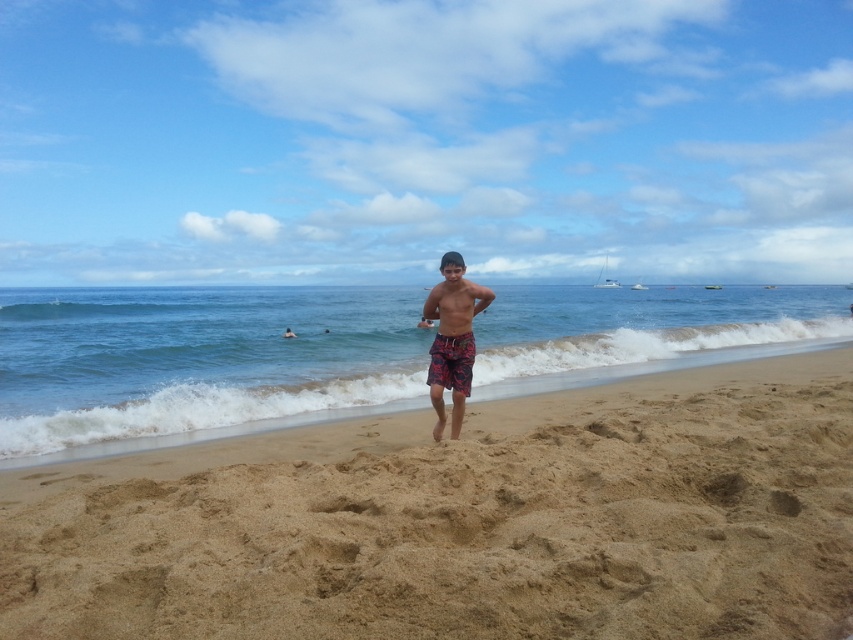
Can you confirm if floral cotton shorts at center is thinner than printed fabric shorts at center?

Yes, floral cotton shorts at center is thinner than printed fabric shorts at center.

Does floral cotton shorts at center lie in front of printed fabric shorts at center?

Yes, it is in front of printed fabric shorts at center.

The width and height of the screenshot is (853, 640). I want to click on floral cotton shorts at center, so click(x=451, y=362).

At what (x,y) coordinates should I click in order to perform the action: click on floral cotton shorts at center. Please return your answer as a coordinate pair (x, y). This screenshot has width=853, height=640. Looking at the image, I should click on (451, 362).

Which is in front, point (461, 257) or point (438, 364)?

Point (438, 364) is in front.

Is printed cotton shorts at center above floral cotton shorts at center?

Yes.

Is point (457, 362) closer to viewer compared to point (431, 378)?

Yes, it is.

The height and width of the screenshot is (640, 853). In order to click on printed cotton shorts at center in this screenshot , I will do point(451,339).

Is brown sandy beach at center positioned before printed cotton shorts at center?

Yes, it is in front of printed cotton shorts at center.

Does brown sandy beach at center have a larger size compared to printed cotton shorts at center?

Correct, brown sandy beach at center is larger in size than printed cotton shorts at center.

Is point (15, 497) closer to viewer compared to point (459, 353)?

That is True.

The width and height of the screenshot is (853, 640). In order to click on brown sandy beach at center in this screenshot , I will do pos(465,520).